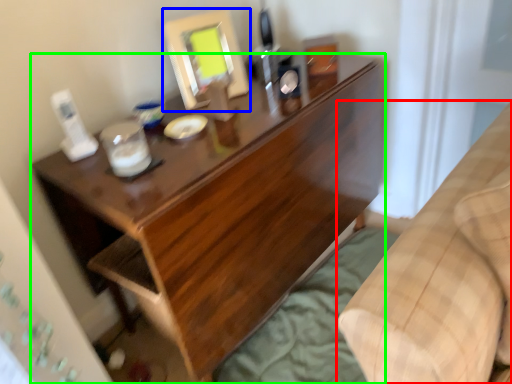
Question: Estimate the real-world distances between objects in this image. Which object is closer to furniture (highlighted by a red box), mirror (highlighted by a blue box) or desk (highlighted by a green box)?

Choices:
 (A) mirror
 (B) desk

Answer: (B)